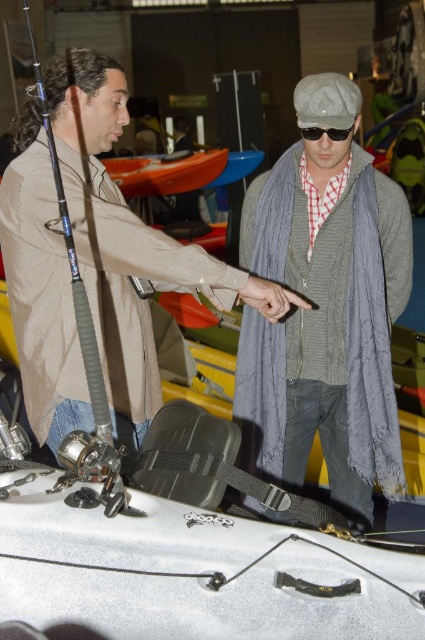
Question: Does gray knitted scarf at center come behind blue matte fishing pole at left?

Choices:
 (A) no
 (B) yes

Answer: (B)

Question: Which of the following is the closest to the observer?

Choices:
 (A) (73, 276)
 (B) (317, 140)
 (C) (48, 276)
 (D) (244, 195)

Answer: (A)

Question: Among these points, which one is farthest from the camera?

Choices:
 (A) pyautogui.click(x=241, y=294)
 (B) pyautogui.click(x=339, y=221)

Answer: (B)

Question: From the image, what is the correct spatial relationship of gray knitted scarf at center in relation to black matte sunglasses at center?

Choices:
 (A) below
 (B) above

Answer: (A)

Question: Is gray knitted scarf at center smaller than black matte sunglasses at center?

Choices:
 (A) yes
 (B) no

Answer: (B)

Question: Which is nearer to the blue matte fishing pole at left?

Choices:
 (A) gray knitted scarf at center
 (B) black matte sunglasses at center
 (C) matte gray scarf at center

Answer: (C)